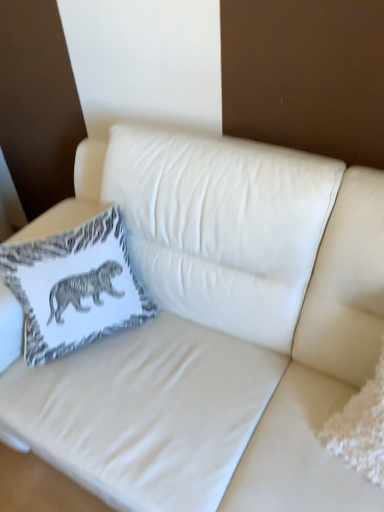
Image resolution: width=384 pixels, height=512 pixels. What do you see at coordinates (74, 285) in the screenshot?
I see `white fabric pillow with elephant print at upper left` at bounding box center [74, 285].

Measure the distance between point [55,323] and camera.

The distance of point [55,323] from camera is 1.14 meters.

Measure the distance between white fabric pillow with elephant print at upper left and camera.

white fabric pillow with elephant print at upper left is 1.12 meters away from camera.

The width and height of the screenshot is (384, 512). In order to click on white fabric pillow with elephant print at upper left in this screenshot , I will do `click(74, 285)`.

I want to click on white fabric pillow with elephant print at upper left, so click(x=74, y=285).